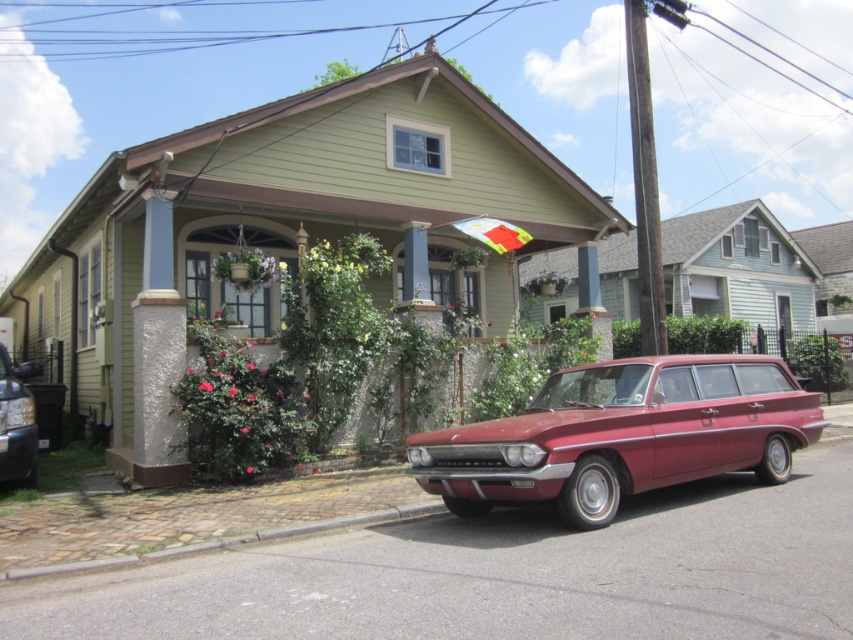
You are a delivery person trying to park your shiny black sedan at left in the driveway next to the glossy red station wagon at center. Considering the height of both vehicles, which one will have more space above it when parked side by side?

The shiny black sedan at left is shorter than the glossy red station wagon at center, so it will have more space above it when parked side by side.

You are standing in front of the house and want to take a photo. There are two points marked on the ground in front of you. The first point is at coordinate point(515, 419) and the second is at point(4, 467). Which point is closer to your camera position?

Point(515, 419) is closer to the camera than point(4, 467).